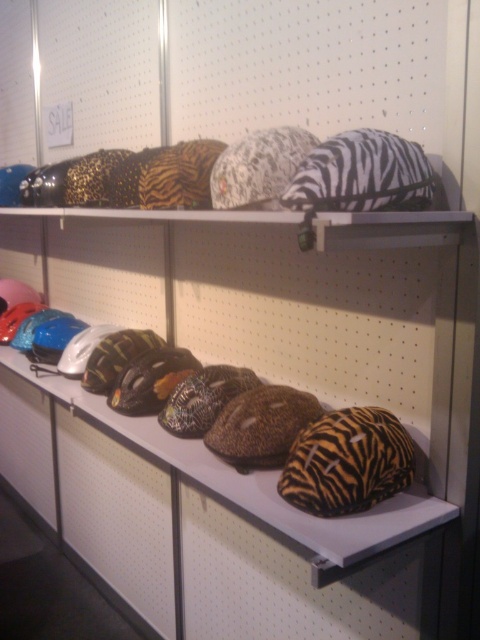
Can you confirm if zebra-patterned helmet at center is shorter than zebra print pillow at upper right?

Incorrect, zebra-patterned helmet at center's height does not fall short of zebra print pillow at upper right's.

Is point (180, 448) farther from camera compared to point (350, 188)?

Yes, point (180, 448) is behind point (350, 188).

Locate an element on the screen. The image size is (480, 640). zebra-patterned helmet at center is located at coordinates (314, 346).